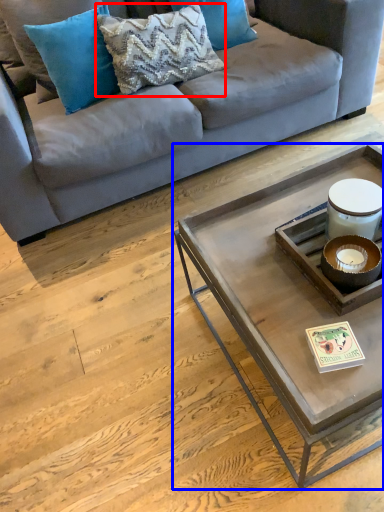
Question: Which object is further to the camera taking this photo, pillow (highlighted by a red box) or coffee table (highlighted by a blue box)?

Choices:
 (A) pillow
 (B) coffee table

Answer: (A)